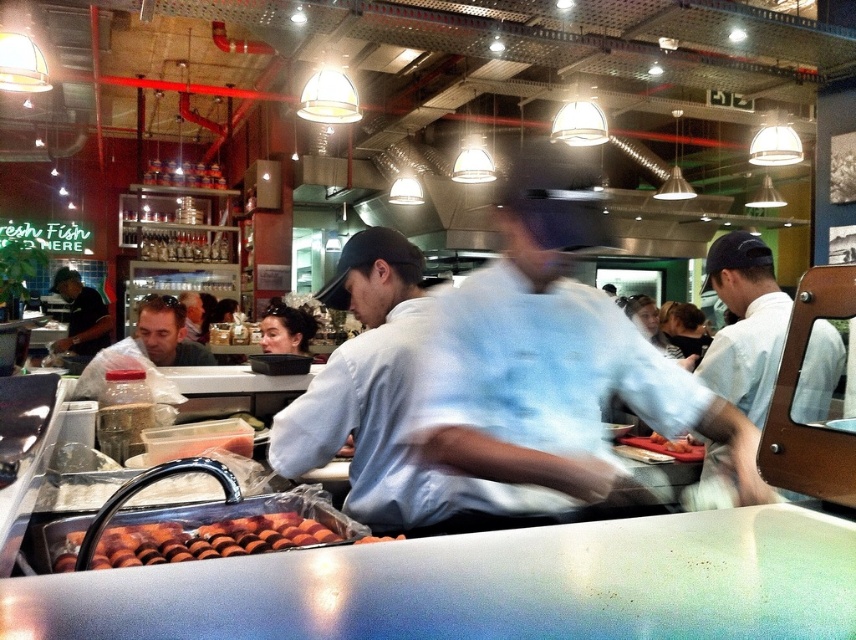
Which is more to the right, golden brown doughnuts at center or matte black shirt at center?

From the viewer's perspective, golden brown doughnuts at center appears more on the right side.

Which is below, golden brown doughnuts at center or matte black shirt at center?

Positioned lower is golden brown doughnuts at center.

The height and width of the screenshot is (640, 856). I want to click on golden brown doughnuts at center, so click(x=192, y=540).

Between white shirt at right and smooth orange slices at center, which one is positioned higher?

white shirt at right

Which is below, white shirt at right or smooth orange slices at center?

Positioned lower is smooth orange slices at center.

Between point (753, 381) and point (389, 536), which one is positioned behind?

Point (753, 381)

Locate an element on the screen. The image size is (856, 640). white shirt at right is located at coordinates (745, 323).

Does golden brown doughnuts at center have a smaller size compared to smooth orange slices at center?

No, golden brown doughnuts at center is not smaller than smooth orange slices at center.

Can you confirm if golden brown doughnuts at center is taller than smooth orange slices at center?

Yes, golden brown doughnuts at center is taller than smooth orange slices at center.

What do you see at coordinates (192, 540) in the screenshot? This screenshot has width=856, height=640. I see `golden brown doughnuts at center` at bounding box center [192, 540].

At what (x,y) coordinates should I click in order to perform the action: click on golden brown doughnuts at center. Please return your answer as a coordinate pair (x, y). The image size is (856, 640). Looking at the image, I should click on (192, 540).